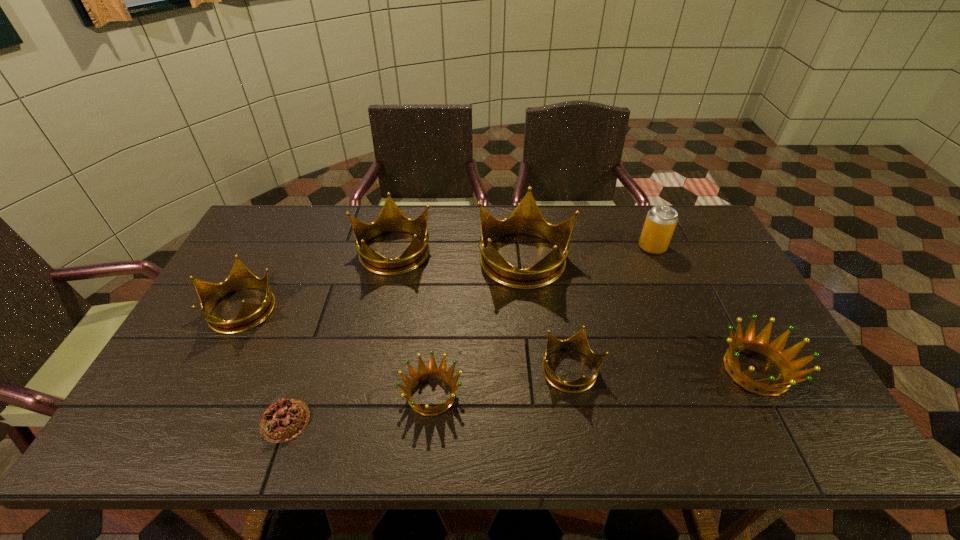
Identify the location of the tallest crown. (526, 219).

Image resolution: width=960 pixels, height=540 pixels. What are the coordinates of `the biggest gold crown` in the screenshot? It's located at (526, 219).

Find the location of a particular element. The height and width of the screenshot is (540, 960). the third gold crown from right to left is located at coordinates (391, 219).

Locate an element on the screen. This screenshot has width=960, height=540. the fifth shortest crown is located at coordinates click(391, 219).

The image size is (960, 540). In order to click on pop (soda) in this screenshot , I will do `click(661, 220)`.

The height and width of the screenshot is (540, 960). I want to click on the third biggest gold crown, so (x=250, y=315).

At what (x,y) coordinates should I click in order to perform the action: click on the leftmost object. Please return your answer as a coordinate pair (x, y). The width and height of the screenshot is (960, 540). Looking at the image, I should click on pos(250,315).

The image size is (960, 540). In order to click on the rightmost crown in this screenshot , I will do `click(773, 350)`.

This screenshot has width=960, height=540. What are the coordinates of `the right golden crown` in the screenshot? It's located at (773, 350).

The width and height of the screenshot is (960, 540). In order to click on the smallest gold crown in this screenshot , I will do `click(578, 342)`.